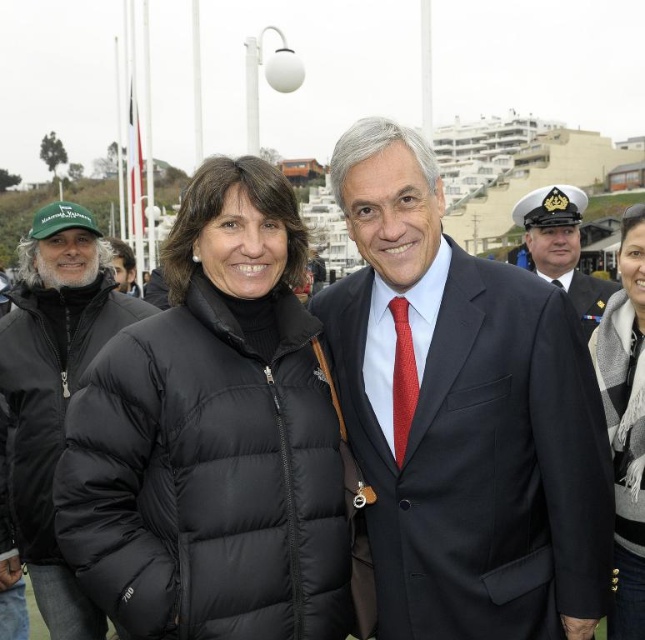
Can you confirm if black puffer jacket at left is positioned to the right of matte black jacket at left?

Correct, you'll find black puffer jacket at left to the right of matte black jacket at left.

Who is more distant from viewer, (x=5, y=502) or (x=119, y=289)?

Positioned behind is point (x=119, y=289).

Where is `black puffer jacket at left`? This screenshot has width=645, height=640. black puffer jacket at left is located at coordinates (50, 396).

Is dark blue woolen suit at center in front of matte black jacket at left?

Yes, dark blue woolen suit at center is closer to the viewer.

This screenshot has width=645, height=640. Describe the element at coordinates (582, 294) in the screenshot. I see `dark blue woolen suit at center` at that location.

The width and height of the screenshot is (645, 640). I want to click on dark blue woolen suit at center, so click(582, 294).

Is black puffer jacket at center closer to camera compared to black wool scarf at right?

Yes, black puffer jacket at center is in front of black wool scarf at right.

Which is below, black puffer jacket at center or black wool scarf at right?

black wool scarf at right is lower down.

Is point (312, 625) more distant than point (637, 416)?

No, it is not.

This screenshot has width=645, height=640. In order to click on black puffer jacket at center in this screenshot , I will do `click(212, 436)`.